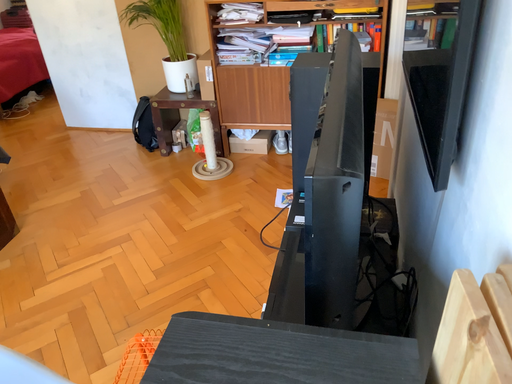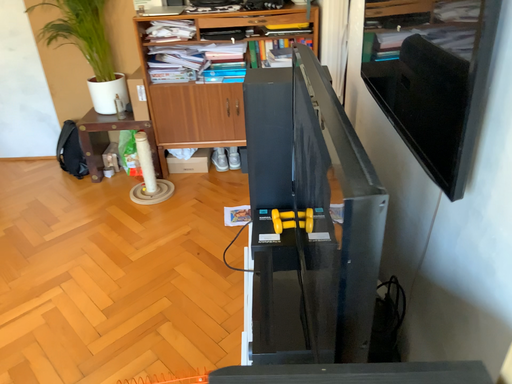
Question: How did the camera likely rotate when shooting the video?

Choices:
 (A) rotated right
 (B) rotated left

Answer: (A)